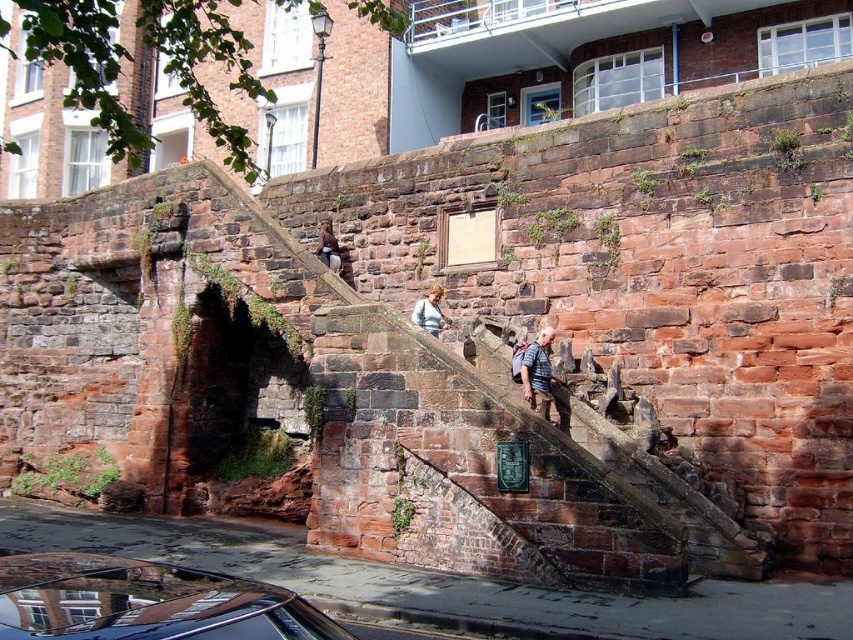
You are standing at the bottom of the historic stone staircase and see a shiny black car at lower left and a brown leather jacket at center. Which object is positioned more to the left side of the scene?

The shiny black car at lower left is positioned more to the left side of the scene than the brown leather jacket at center.

You are a photographer standing at the bottom of the historic stone staircase. You want to capture both the shiny black car at lower left and the brown leather jacket at center in a single frame. Which object should you focus on first to ensure both are in the frame?

You should focus on the shiny black car at lower left first because it is larger in size than the brown leather jacket at center, so it will take up more space in the frame and ensure both are included.

You are standing at the bottom of the historic stone staircase and notice a shiny black car at lower left and a smooth gray sweater at center. Which object is positioned lower in the scene?

The shiny black car at lower left is positioned lower than the smooth gray sweater at center.